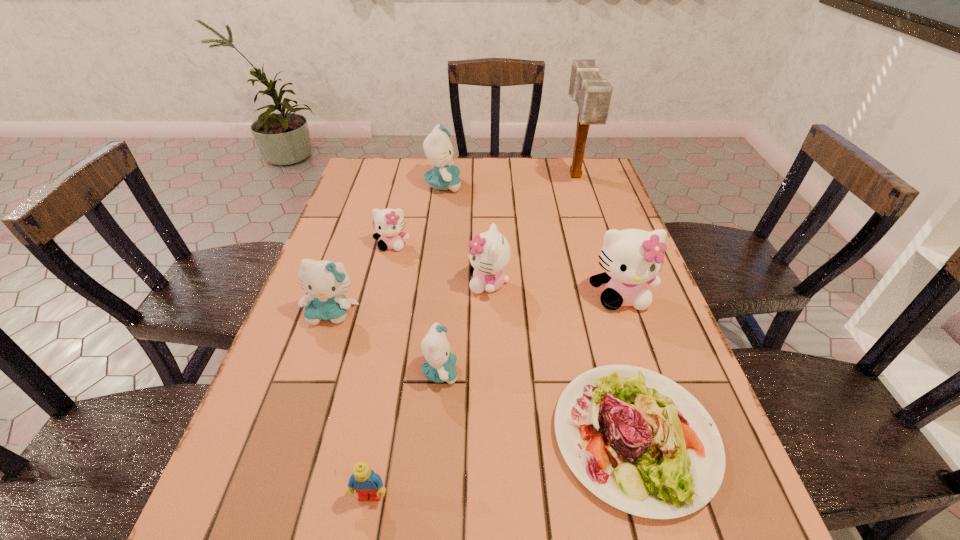
The height and width of the screenshot is (540, 960). Identify the location of the nearest blue kitten. (439, 367).

Where is `the nearest kitten`? The height and width of the screenshot is (540, 960). the nearest kitten is located at coordinates (439, 367).

Where is `the leftmost white kitten`? The image size is (960, 540). the leftmost white kitten is located at coordinates (388, 223).

Locate an element on the screen. Image resolution: width=960 pixels, height=540 pixels. the smallest white kitten is located at coordinates [x=388, y=223].

Identify the location of Lego. The image size is (960, 540). (365, 482).

Image resolution: width=960 pixels, height=540 pixels. Find the location of `the second shortest object`. the second shortest object is located at coordinates (365, 482).

Locate an element on the screen. This screenshot has height=540, width=960. green salad plate is located at coordinates (671, 463).

Where is `salad plate`? The image size is (960, 540). salad plate is located at coordinates (671, 463).

Where is `vacant space situated on the front of the tallest object`? vacant space situated on the front of the tallest object is located at coordinates (610, 282).

This screenshot has width=960, height=540. I want to click on free location located on the face of the farthest blue kitten, so click(532, 185).